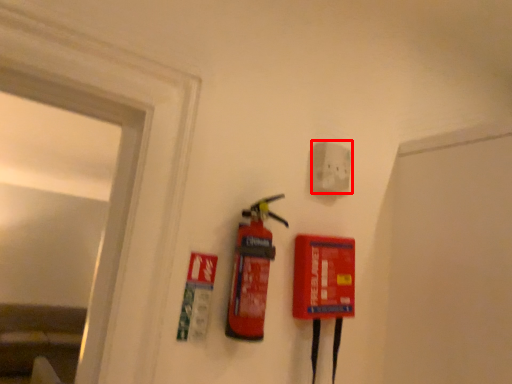
Question: In this image, where is electric outlet (annotated by the red box) located relative to fire extinguisher?

Choices:
 (A) left
 (B) right

Answer: (B)